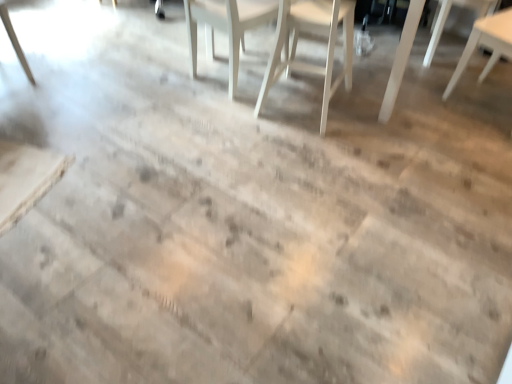
Question: Can you confirm if light brown wood table at lower left is bigger than white wood chair at center, the 3th chair in the right-to-left sequence?

Choices:
 (A) yes
 (B) no

Answer: (B)

Question: Does light brown wood table at lower left appear on the left side of white wood chair at center, the 3th chair in the right-to-left sequence?

Choices:
 (A) no
 (B) yes

Answer: (B)

Question: Would you consider light brown wood table at lower left to be distant from white wood chair at center, which appears as the 2th chair when viewed from the left?

Choices:
 (A) yes
 (B) no

Answer: (A)

Question: From the image's perspective, does light brown wood table at lower left appear lower than white wood chair at center, which appears as the 2th chair when viewed from the left?

Choices:
 (A) no
 (B) yes

Answer: (B)

Question: Does light brown wood table at lower left have a lesser height compared to white wood chair at center, which appears as the 2th chair when viewed from the left?

Choices:
 (A) yes
 (B) no

Answer: (A)

Question: Does light brown wood table at lower left appear on the right side of white wood chair at center, which appears as the 2th chair when viewed from the left?

Choices:
 (A) yes
 (B) no

Answer: (B)

Question: From the image's perspective, is white wood chair at upper right, which is the 4th chair in left-to-right order, above white wood chair at upper right, the third chair in the left-to-right sequence?

Choices:
 (A) no
 (B) yes

Answer: (A)

Question: Does white wood chair at upper right, positioned as the 1th chair in right-to-left order, come in front of white wood chair at upper right, the third chair in the left-to-right sequence?

Choices:
 (A) no
 (B) yes

Answer: (B)

Question: Can you confirm if white wood chair at upper right, positioned as the 1th chair in right-to-left order, is smaller than white wood chair at upper right, placed as the 2th chair when sorted from right to left?

Choices:
 (A) no
 (B) yes

Answer: (A)

Question: Would you say white wood chair at upper right, positioned as the 1th chair in right-to-left order, is outside white wood chair at upper right, placed as the 2th chair when sorted from right to left?

Choices:
 (A) yes
 (B) no

Answer: (A)

Question: Is white wood chair at upper right, positioned as the 1th chair in right-to-left order, taller than white wood chair at upper right, placed as the 2th chair when sorted from right to left?

Choices:
 (A) no
 (B) yes

Answer: (B)

Question: Is white wood chair at upper right, which is the 4th chair in left-to-right order, far from white wood chair at upper right, placed as the 2th chair when sorted from right to left?

Choices:
 (A) yes
 (B) no

Answer: (B)

Question: Is white wood chair at center, the 4th chair positioned from the right, closer to the viewer compared to light brown wood table at lower left?

Choices:
 (A) no
 (B) yes

Answer: (A)